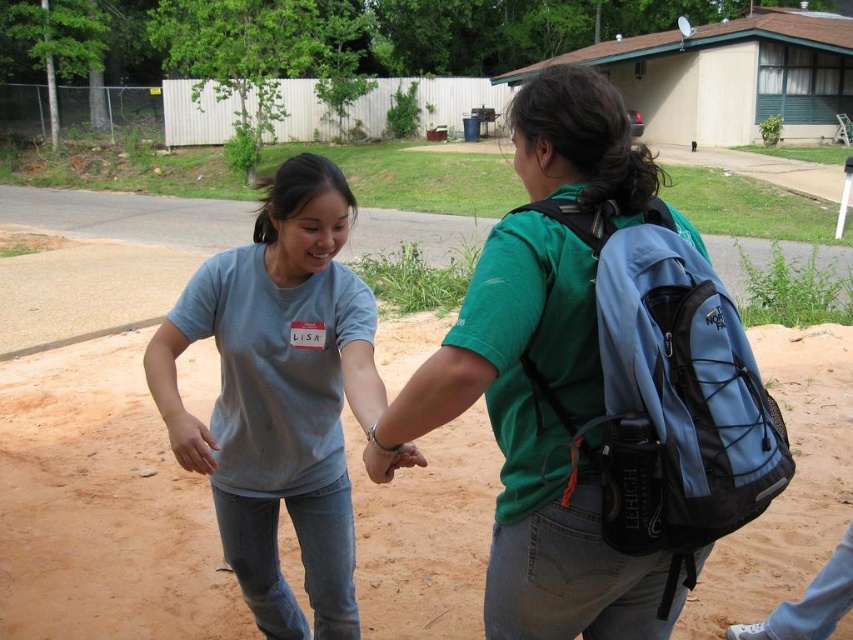
Can you confirm if brown sandy ground at lower center is wider than matte gray t-shirt at center?

Correct, the width of brown sandy ground at lower center exceeds that of matte gray t-shirt at center.

Is brown sandy ground at lower center positioned at the back of matte gray t-shirt at center?

Yes, it is behind matte gray t-shirt at center.

Identify the location of brown sandy ground at lower center. (102, 508).

Who is higher up, brown sandy ground at lower center or blue fabric backpack at right?

Positioned higher is blue fabric backpack at right.

Identify the location of brown sandy ground at lower center. (102, 508).

Locate an element on the screen. This screenshot has height=640, width=853. brown sandy ground at lower center is located at coordinates (102, 508).

Is blue fabric backpack at center thinner than matte gray t-shirt at center?

In fact, blue fabric backpack at center might be wider than matte gray t-shirt at center.

How far apart are blue fabric backpack at center and matte gray t-shirt at center?

blue fabric backpack at center is 20.80 inches from matte gray t-shirt at center.

What do you see at coordinates (596, 384) in the screenshot? This screenshot has width=853, height=640. I see `blue fabric backpack at center` at bounding box center [596, 384].

The width and height of the screenshot is (853, 640). Identify the location of blue fabric backpack at center. (596, 384).